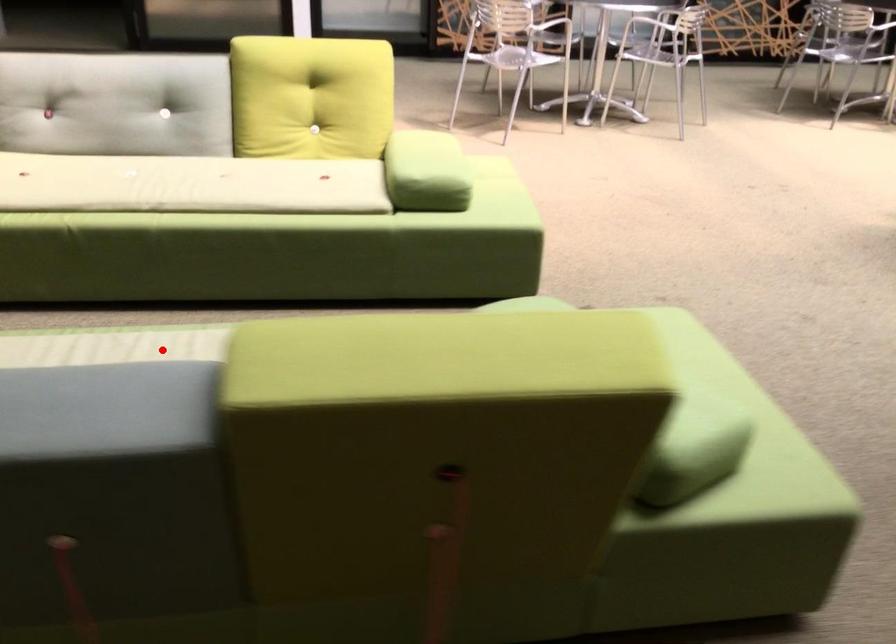
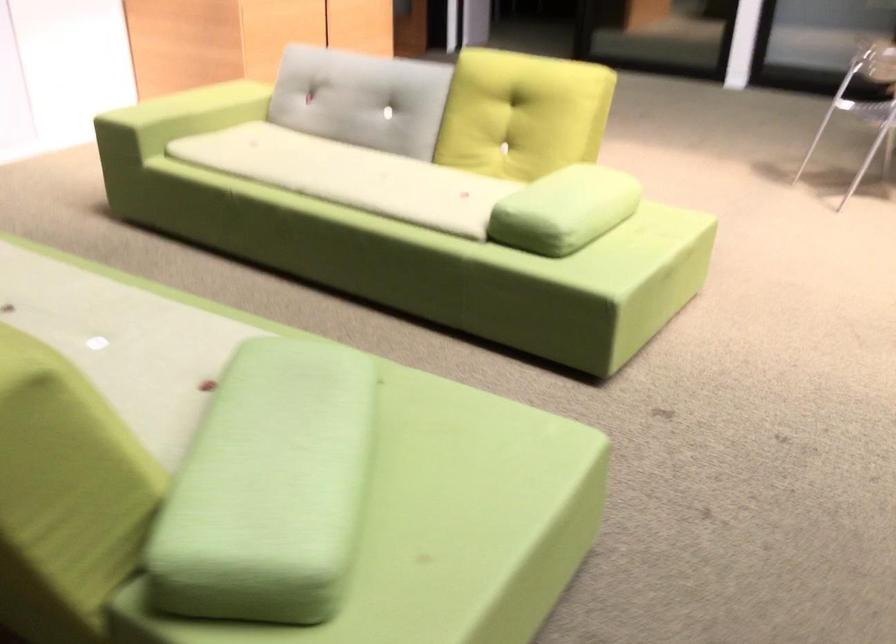
Question: A red point is marked in image1. In image2, is the corresponding 3D point closer to the camera or farther? Reply with the corresponding letter.

Choices:
 (A) The corresponding 3D point is closer.
 (B) The corresponding 3D point is farther.

Answer: (B)